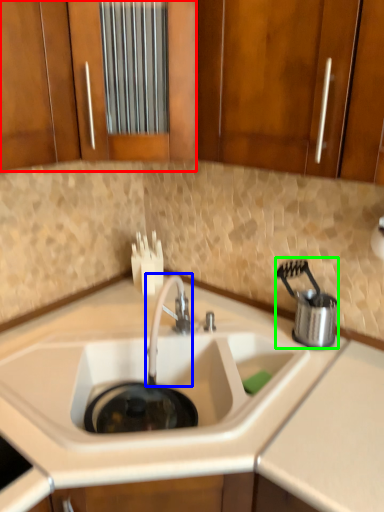
Question: Which object is the farthest from cabinetry (highlighted by a red box)? Choose among these: tap (highlighted by a blue box) or appliance (highlighted by a green box).

Choices:
 (A) tap
 (B) appliance

Answer: (B)